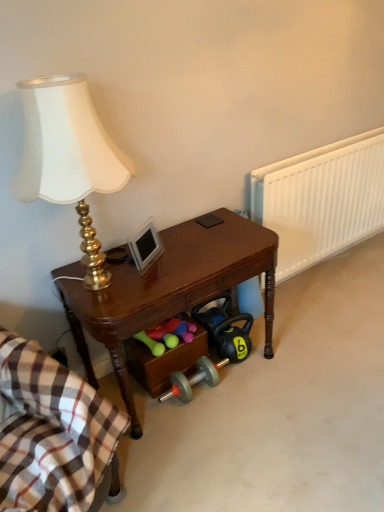
This screenshot has width=384, height=512. Identify the location of vacant space underneath gold metallic lamp at left (from a real-world perspective). (110, 282).